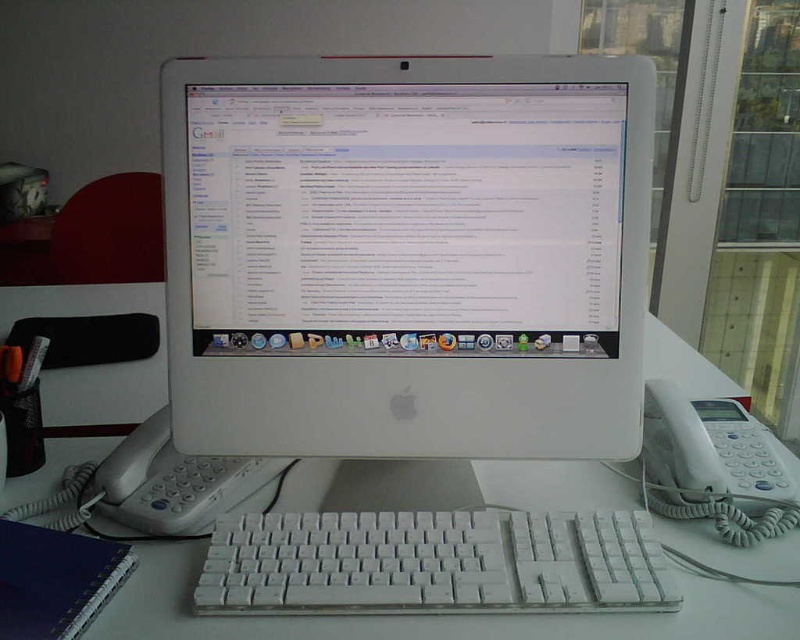
Question: Does white glossy monitor at center have a lesser width compared to white plastic computer desk at center?

Choices:
 (A) yes
 (B) no

Answer: (A)

Question: Among these points, which one is farthest from the camera?

Choices:
 (A) (441, 376)
 (B) (501, 609)
 (C) (470, 486)

Answer: (C)

Question: Which is farther from the white plastic keyboard at center?

Choices:
 (A) white plastic computer desk at center
 (B) white glossy monitor at center

Answer: (B)

Question: Observing the image, what is the correct spatial positioning of white glossy monitor at center in reference to white plastic keyboard at center?

Choices:
 (A) right
 (B) left

Answer: (B)

Question: Which object is positioned closest to the white plastic computer desk at center?

Choices:
 (A) white plastic keyboard at center
 (B) white glossy monitor at center

Answer: (A)

Question: Does white plastic computer desk at center have a larger size compared to white plastic keyboard at center?

Choices:
 (A) yes
 (B) no

Answer: (A)